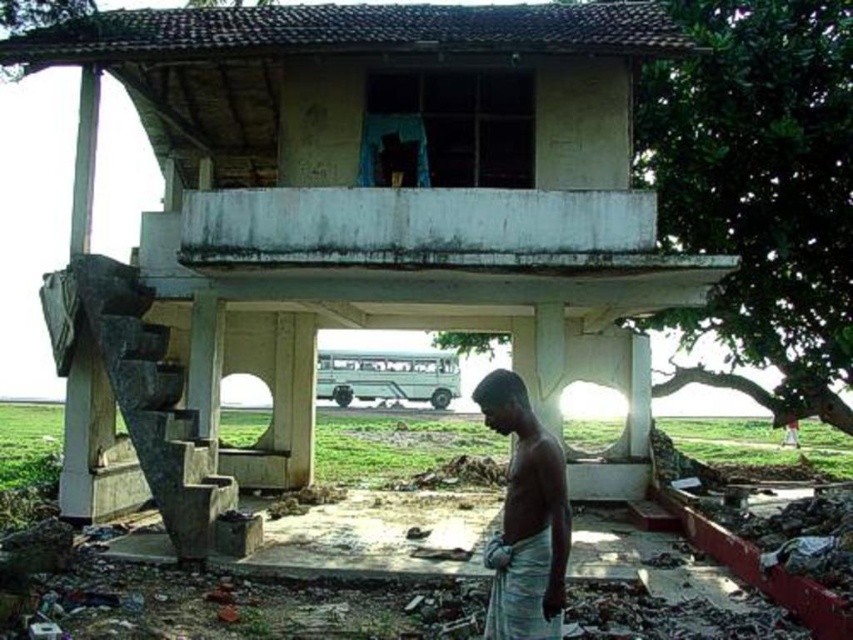
You are navigating through a rural area and see the dilapidated two story structure. You need to determine the shortest path to reach the point marked as point (805, 92) from point marked as point (543, 564). Which direction should you move relative to the structure?

Since point (805, 92) is closer to the viewer than point (543, 564), you should move towards the structure to reach the destination point.